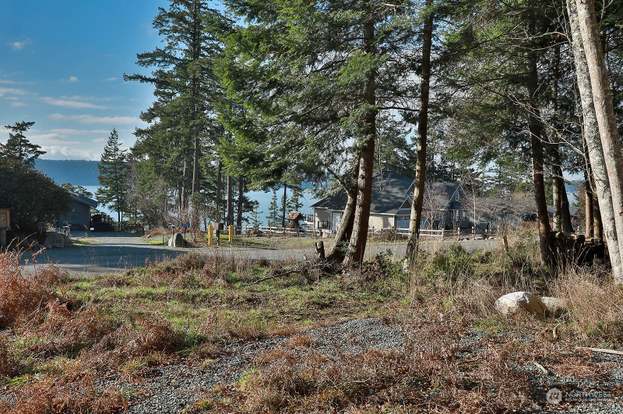
Locate an element on the screen. window is located at coordinates (459, 211), (459, 195).